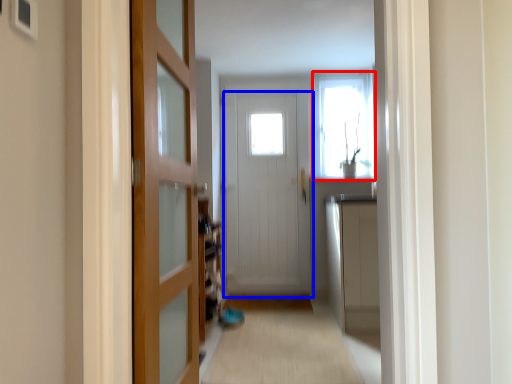
Question: Which point is closer to the camera, window (highlighted by a red box) or door (highlighted by a blue box)?

Choices:
 (A) window
 (B) door

Answer: (B)